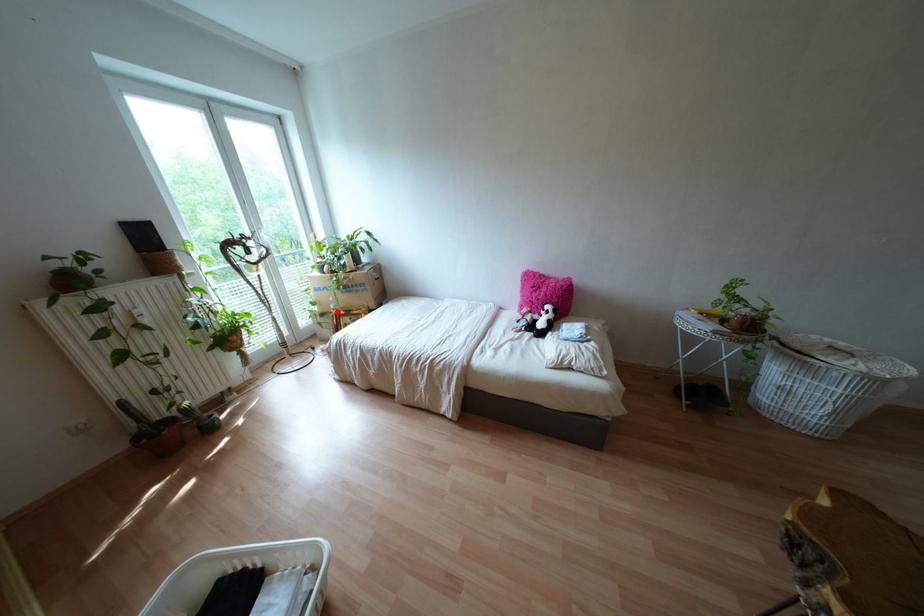
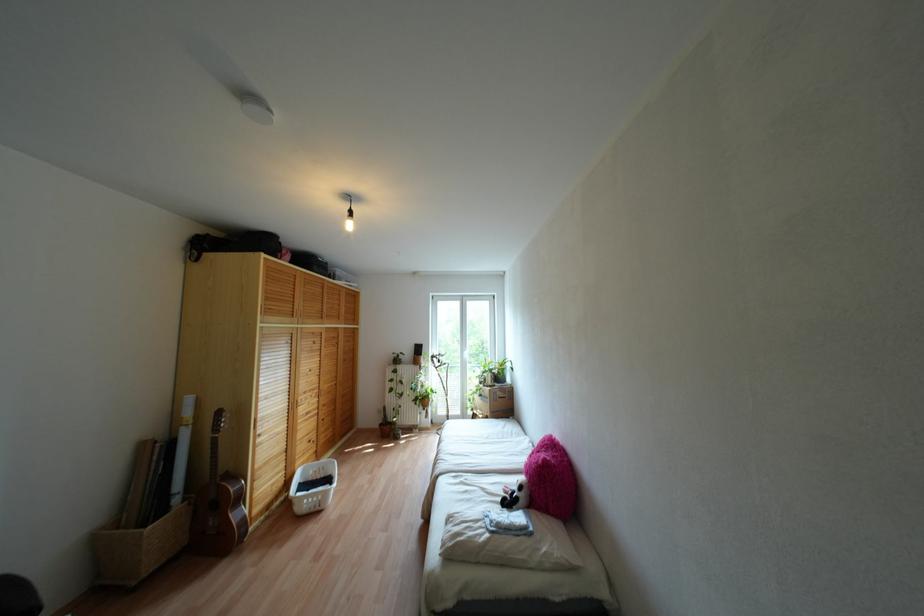
In the second image, find the point that corresponds to the highlighted location in the first image.

(473, 411)